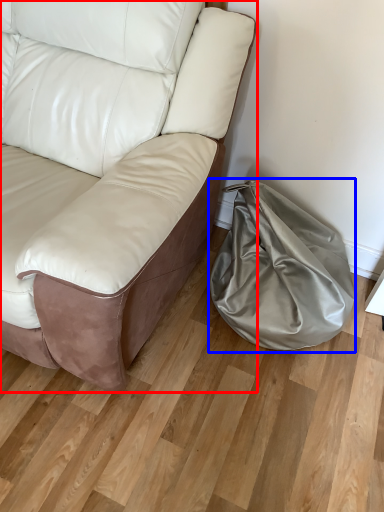
Question: Which point is further to the camera, studio couch (highlighted by a red box) or bean bag chair (highlighted by a blue box)?

Choices:
 (A) studio couch
 (B) bean bag chair

Answer: (B)